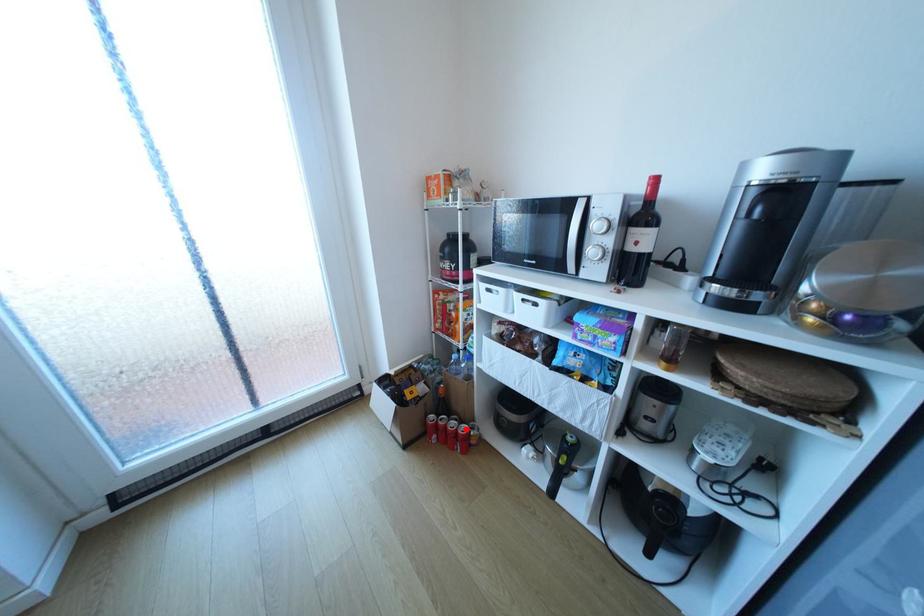
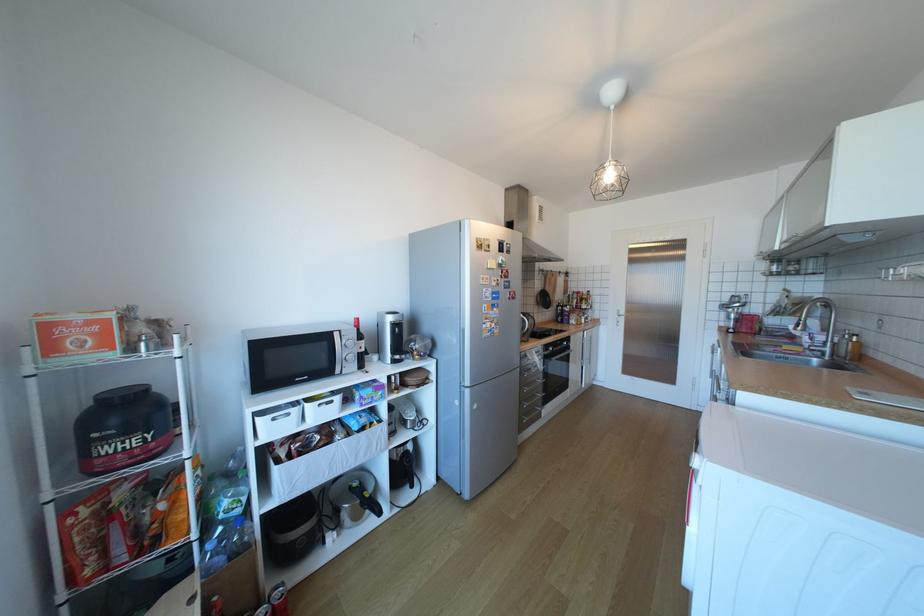
Question: I am providing you with two images of the same scene from different viewpoints. Given a red point in image1, look at the same physical point in image2. Is it:

Choices:
 (A) Closer to the viewpoint
 (B) Farther from the viewpoint

Answer: (A)